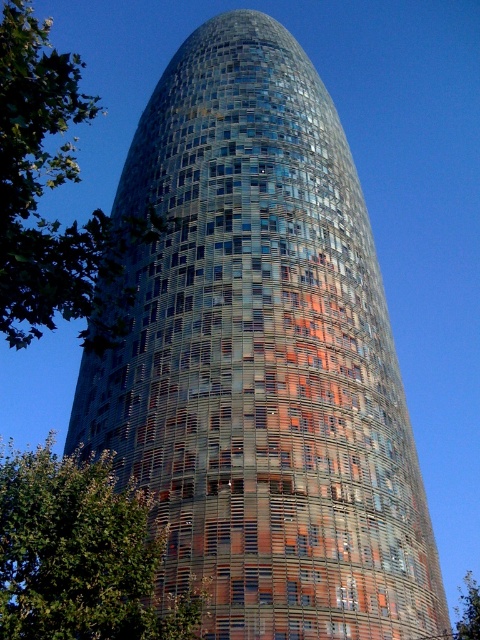
You are standing at point (x=82, y=554) in the image. What do you see in the direction of the green leafy tree at lower left?

At point (x=82, y=554), you are facing the green leafy tree at lower left, so you would see the tree in that direction.

You are standing in front of the tall cylindrical building and see the green leafy tree at left and the green leafy tree at upper left. Which tree is closer to the building?

The green leafy tree at left is closer to the building because it is positioned on the left side of the green leafy tree at upper left, indicating it is in front.